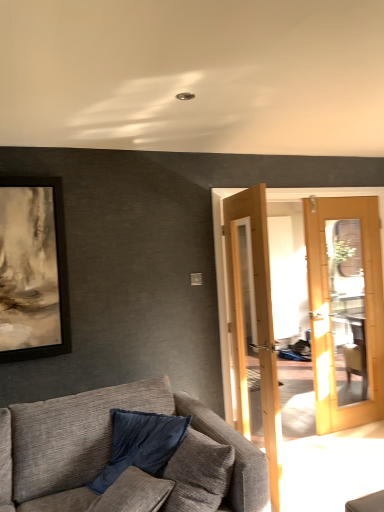
Question: Is velvet blue pillow at lower left smaller than textured gray couch at lower left?

Choices:
 (A) yes
 (B) no

Answer: (A)

Question: Is velvet blue pillow at lower left next to textured gray couch at lower left and touching it?

Choices:
 (A) yes
 (B) no

Answer: (B)

Question: Is velvet blue pillow at lower left further to camera compared to textured gray couch at lower left?

Choices:
 (A) no
 (B) yes

Answer: (B)

Question: Are velvet blue pillow at lower left and textured gray couch at lower left far apart?

Choices:
 (A) no
 (B) yes

Answer: (A)

Question: Does velvet blue pillow at lower left come in front of textured gray couch at lower left?

Choices:
 (A) yes
 (B) no

Answer: (B)

Question: Could you tell me if velvet blue pillow at lower left is turned towards textured gray couch at lower left?

Choices:
 (A) no
 (B) yes

Answer: (B)

Question: Are textured gray couch at lower left and velvet blue pillow at lower left beside each other?

Choices:
 (A) no
 (B) yes

Answer: (A)

Question: Can you confirm if textured gray couch at lower left is shorter than velvet blue pillow at lower left?

Choices:
 (A) no
 (B) yes

Answer: (A)

Question: Is textured gray couch at lower left taller than velvet blue pillow at lower left?

Choices:
 (A) no
 (B) yes

Answer: (B)

Question: Considering the relative positions of textured gray couch at lower left and velvet blue pillow at lower left in the image provided, is textured gray couch at lower left to the left of velvet blue pillow at lower left from the viewer's perspective?

Choices:
 (A) yes
 (B) no

Answer: (A)

Question: Can you confirm if textured gray couch at lower left is positioned to the right of velvet blue pillow at lower left?

Choices:
 (A) yes
 (B) no

Answer: (B)

Question: Is textured gray couch at lower left oriented towards velvet blue pillow at lower left?

Choices:
 (A) yes
 (B) no

Answer: (A)

Question: Considering their positions, is textured gray couch at lower left located in front of or behind velvet blue pillow at lower left?

Choices:
 (A) behind
 (B) front

Answer: (B)